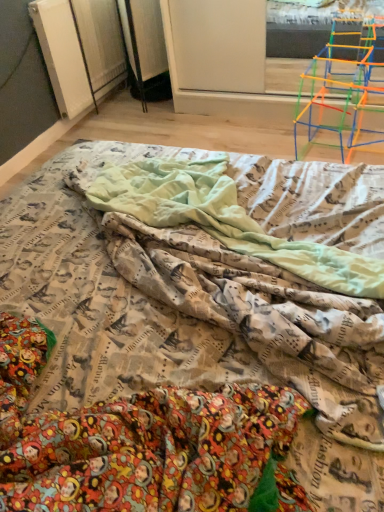
Question: Does printed fabric bed at center appear on the right side of printed fabric blanket at center?

Choices:
 (A) no
 (B) yes

Answer: (A)

Question: Is printed fabric bed at center wider than printed fabric blanket at center?

Choices:
 (A) no
 (B) yes

Answer: (B)

Question: Is printed fabric bed at center positioned in front of printed fabric blanket at center?

Choices:
 (A) no
 (B) yes

Answer: (B)

Question: Can you confirm if printed fabric bed at center is thinner than printed fabric blanket at center?

Choices:
 (A) no
 (B) yes

Answer: (A)

Question: Would you say printed fabric bed at center is outside printed fabric blanket at center?

Choices:
 (A) no
 (B) yes

Answer: (B)

Question: Looking at the image, does printed fabric bed at center seem bigger or smaller compared to translucent plastic toy at upper right?

Choices:
 (A) small
 (B) big

Answer: (B)

Question: Is point (187, 395) positioned closer to the camera than point (347, 50)?

Choices:
 (A) closer
 (B) farther

Answer: (A)

Question: Looking at their shapes, would you say printed fabric bed at center is wider or thinner than translucent plastic toy at upper right?

Choices:
 (A) wide
 (B) thin

Answer: (A)

Question: Is printed fabric bed at center inside or outside of translucent plastic toy at upper right?

Choices:
 (A) outside
 (B) inside

Answer: (A)

Question: In the image, is translucent plastic toy at upper right on the left side or the right side of printed fabric bed at center?

Choices:
 (A) left
 (B) right

Answer: (B)

Question: Is translucent plastic toy at upper right inside or outside of printed fabric bed at center?

Choices:
 (A) outside
 (B) inside

Answer: (A)

Question: Based on their sizes in the image, would you say translucent plastic toy at upper right is bigger or smaller than printed fabric bed at center?

Choices:
 (A) small
 (B) big

Answer: (A)

Question: From the image's perspective, relative to printed fabric bed at center, is translucent plastic toy at upper right above or below?

Choices:
 (A) below
 (B) above

Answer: (B)

Question: Considering the positions of printed fabric blanket at center and translucent plastic toy at upper right in the image, is printed fabric blanket at center wider or thinner than translucent plastic toy at upper right?

Choices:
 (A) wide
 (B) thin

Answer: (A)

Question: From a real-world perspective, relative to translucent plastic toy at upper right, is printed fabric blanket at center vertically above or below?

Choices:
 (A) above
 (B) below

Answer: (B)